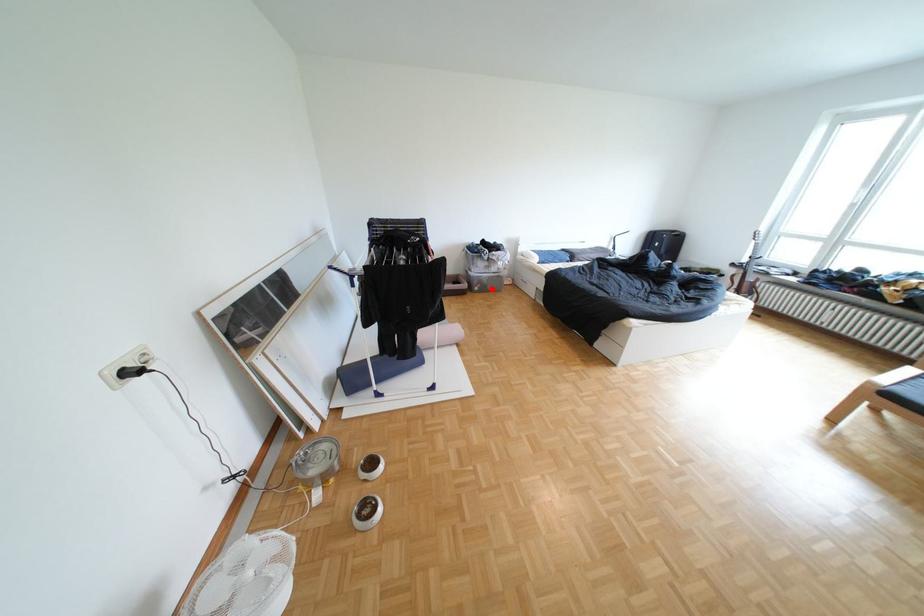
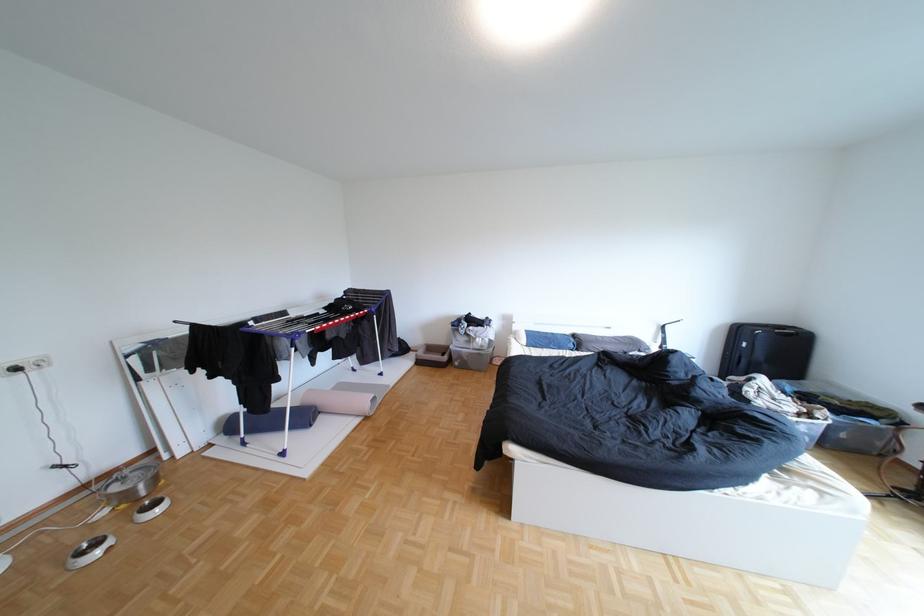
Question: A red point is marked in image1. In image2, is the corresponding 3D point closer to the camera or farther? Reply with the corresponding letter.

Choices:
 (A) The corresponding 3D point is closer.
 (B) The corresponding 3D point is farther.

Answer: (B)